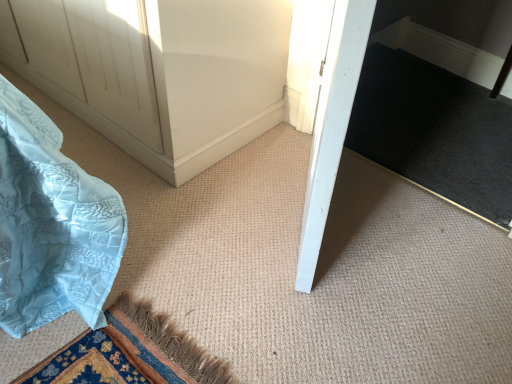
The height and width of the screenshot is (384, 512). Find the location of `black carpet at center`. black carpet at center is located at coordinates [435, 131].

What is the approximate height of black carpet at center?

1.30 inches.

What do you see at coordinates (435, 131) in the screenshot? I see `black carpet at center` at bounding box center [435, 131].

Describe the element at coordinates (332, 125) in the screenshot. I see `white smooth door at center` at that location.

Locate an element on the screen. Image resolution: width=512 pixels, height=384 pixels. white smooth door at center is located at coordinates point(332,125).

Where is `black carpet at center`? This screenshot has width=512, height=384. black carpet at center is located at coordinates (435, 131).

Between black carpet at center and white smooth door at center, which one appears on the left side from the viewer's perspective?

Positioned to the left is white smooth door at center.

Which is in front, black carpet at center or white smooth door at center?

white smooth door at center.

Which point is more distant from viewer, (476,145) or (335,23)?

Positioned behind is point (476,145).

From the image's perspective, which one is positioned lower, black carpet at center or white smooth door at center?

white smooth door at center appears lower in the image.

From a real-world perspective, is black carpet at center under white smooth door at center?

Yes, from a real-world perspective, black carpet at center is beneath white smooth door at center.

Which of these two, black carpet at center or white smooth door at center, is thinner?

Thinner between the two is white smooth door at center.

From their relative heights in the image, would you say black carpet at center is taller or shorter than white smooth door at center?

Considering their sizes, black carpet at center has less height than white smooth door at center.

Who is smaller, black carpet at center or white smooth door at center?

black carpet at center is smaller.

Consider the image. Would you say black carpet at center is inside or outside white smooth door at center?

The correct answer is: outside.

Is black carpet at center beside white smooth door at center?

They are not placed beside each other.

Is black carpet at center oriented away from white smooth door at center?

No, black carpet at center is not facing away from white smooth door at center.

Can you tell me how much black carpet at center and white smooth door at center differ in facing direction?

29.5 degrees separate the facing orientations of black carpet at center and white smooth door at center.

At what (x,y) coordinates should I click in order to perform the action: click on door that is below the black carpet at center (from the image's perspective). Please return your answer as a coordinate pair (x, y). This screenshot has height=384, width=512. Looking at the image, I should click on (332, 125).

Is white smooth door at center to the left of black carpet at center from the viewer's perspective?

Indeed, white smooth door at center is positioned on the left side of black carpet at center.

Considering their positions, is white smooth door at center located in front of or behind black carpet at center?

white smooth door at center is in front of black carpet at center.

Considering the positions of points (338, 78) and (502, 214), is point (338, 78) closer to camera compared to point (502, 214)?

Yes, point (338, 78) is closer to viewer.

From the image's perspective, is white smooth door at center beneath black carpet at center?

Yes.

From a real-world perspective, between white smooth door at center and black carpet at center, who is vertically higher?

Answer: white smooth door at center, from a real-world perspective.

Which of these two, white smooth door at center or black carpet at center, is wider?

Wider between the two is black carpet at center.

Is white smooth door at center taller than black carpet at center?

Correct, white smooth door at center is much taller as black carpet at center.

Looking at the image, does white smooth door at center seem bigger or smaller compared to black carpet at center?

Clearly, white smooth door at center is larger in size than black carpet at center.

Is white smooth door at center inside or outside of black carpet at center?

white smooth door at center is located beyond the bounds of black carpet at center.

Are white smooth door at center and black carpet at center far apart?

Actually, white smooth door at center and black carpet at center are a little close together.

Is white smooth door at center facing away from black carpet at center?

No, black carpet at center is not at the back of white smooth door at center.

Can you tell me how much white smooth door at center and black carpet at center differ in facing direction?

white smooth door at center and black carpet at center are facing 29.5 degrees away from each other.

The height and width of the screenshot is (384, 512). In order to click on doormat lying behind the white smooth door at center in this screenshot , I will do `click(435, 131)`.

Find the location of a particular element. door that appears on the left of black carpet at center is located at coordinates (332, 125).

Locate an element on the screen. Image resolution: width=512 pixels, height=384 pixels. door below the black carpet at center (from the image's perspective) is located at coordinates (332, 125).